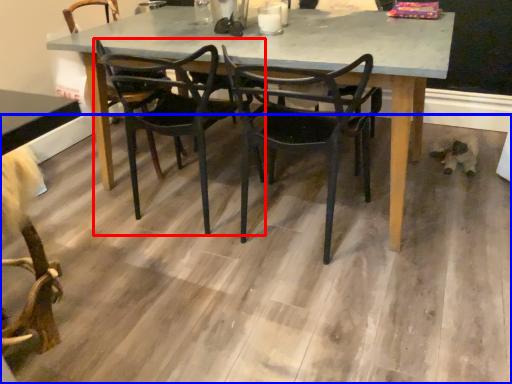
Question: Which of the following is the closest to the observer, chair (highlighted by a red box) or concrete (highlighted by a blue box)?

Choices:
 (A) chair
 (B) concrete

Answer: (B)